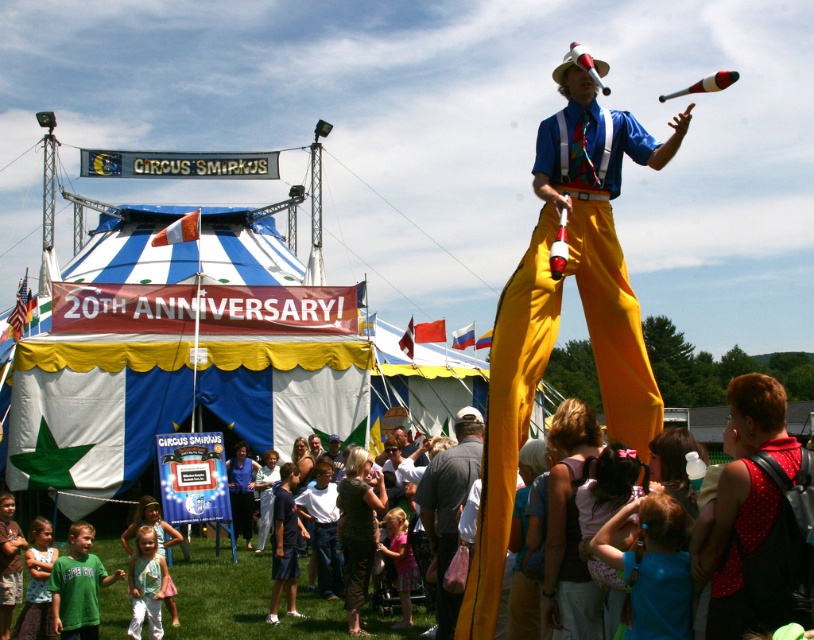
Question: Is matte yellow pants at center to the right of gray fabric shirt at center from the viewer's perspective?

Choices:
 (A) yes
 (B) no

Answer: (A)

Question: Which point is farther to the camera?

Choices:
 (A) (139, 596)
 (B) (42, 589)

Answer: (A)

Question: Does blue fabric dress at center have a lesser width compared to light blue fabric dress at lower left?

Choices:
 (A) yes
 (B) no

Answer: (B)

Question: Observing the image, what is the correct spatial positioning of blue fabric dress at center in reference to light blue fabric dress at lower left?

Choices:
 (A) left
 (B) right

Answer: (B)

Question: Which object is farther from the camera taking this photo?

Choices:
 (A) light blue fabric dress at lower left
 (B) green cotton shirt at lower left
 (C) light pink fabric dress at lower center

Answer: (C)

Question: Which point is farther to the camera?

Choices:
 (A) light pink fabric dress at lower center
 (B) light blue cotton dress at lower left

Answer: (A)